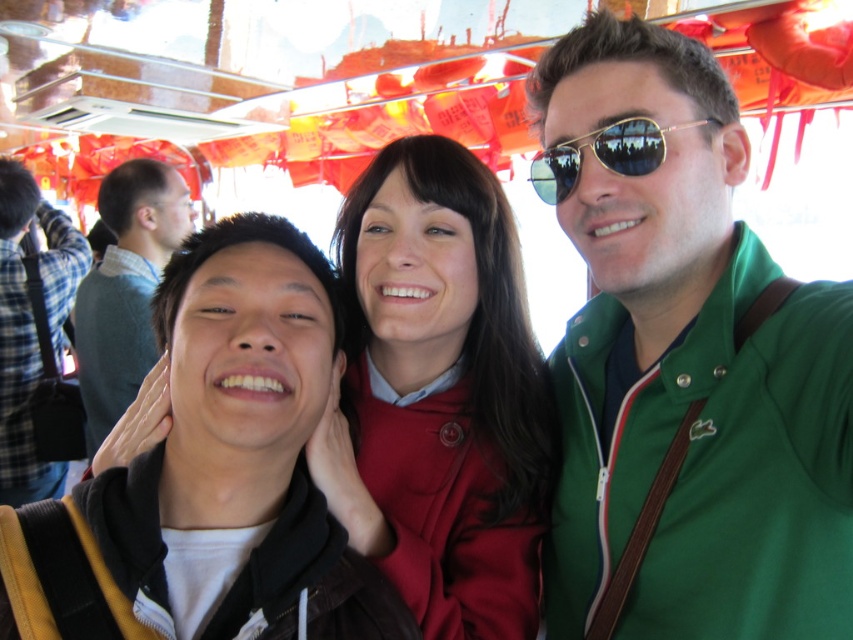
Is light brown hair at left smaller than plaid flannel shirt at left?

Yes.

Based on the photo, does light brown hair at left appear on the right side of plaid flannel shirt at left?

Correct, you'll find light brown hair at left to the right of plaid flannel shirt at left.

Is point (132, 220) behind point (62, 275)?

No, (132, 220) is closer to viewer.

At what (x,y) coordinates should I click in order to perform the action: click on light brown hair at left. Please return your answer as a coordinate pair (x, y). This screenshot has height=640, width=853. Looking at the image, I should click on (126, 288).

Is plaid flannel shirt at left closer to the viewer compared to gold reflective sunglasses at center?

No, it is not.

Does plaid flannel shirt at left have a greater height compared to gold reflective sunglasses at center?

Yes.

Is point (4, 202) behind point (645, 168)?

Yes, it is.

Where is `plaid flannel shirt at left`? plaid flannel shirt at left is located at coordinates (30, 326).

Who is positioned more to the left, light brown hair at left or gold reflective sunglasses at center?

light brown hair at left is more to the left.

Between light brown hair at left and gold reflective sunglasses at center, which one appears on the right side from the viewer's perspective?

Positioned to the right is gold reflective sunglasses at center.

Does point (83, 380) come behind point (543, 164)?

Yes, point (83, 380) is behind point (543, 164).

The height and width of the screenshot is (640, 853). In order to click on light brown hair at left in this screenshot , I will do `click(126, 288)`.